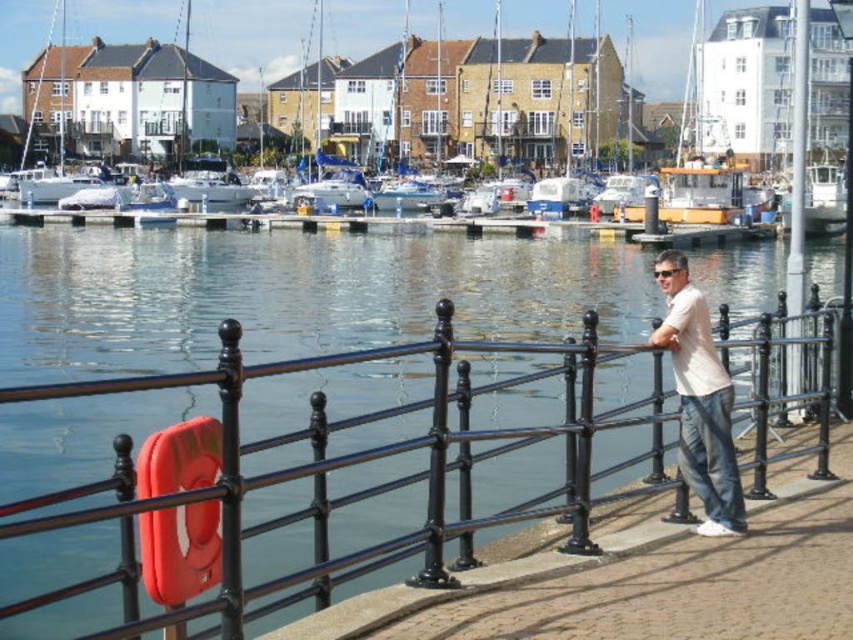
You are standing at the marina and see the black metal fence at center and the white plastic boat at center. Which object is positioned to the left when viewed from your perspective?

The black metal fence at center is to the left of the white plastic boat at center, so it is positioned to the left.

You are standing at the edge of the marina and want to know the distance between the black metal fence at center and the white plastic boat at center. Can you estimate how far apart they are?

The black metal fence at center is 135.40 meters away from the white plastic boat at center.